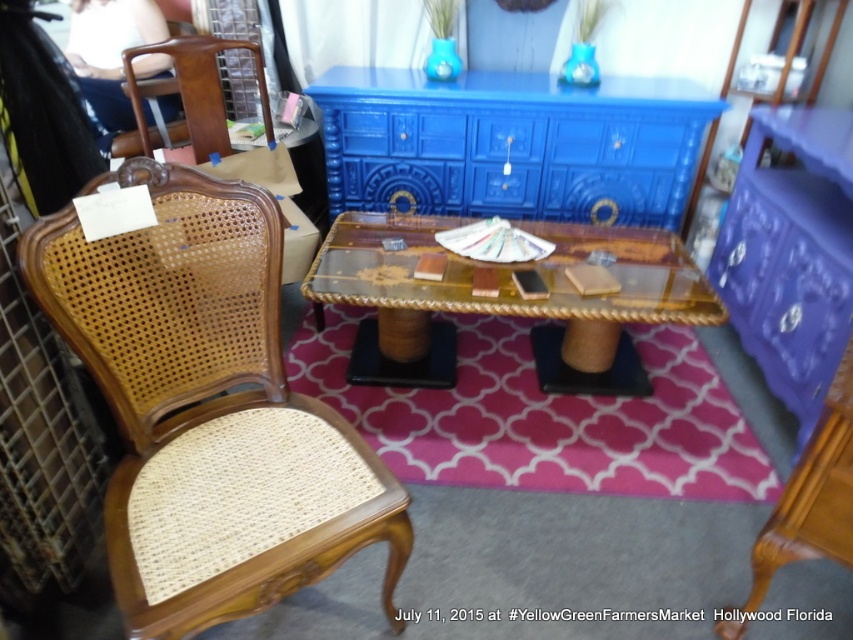
Which is more to the right, transparent acrylic table at center or purple glossy dresser at center?

From the viewer's perspective, purple glossy dresser at center appears more on the right side.

Which of these two, transparent acrylic table at center or purple glossy dresser at center, stands taller?

purple glossy dresser at center

At what (x,y) coordinates should I click in order to perform the action: click on transparent acrylic table at center. Please return your answer as a coordinate pair (x, y). Image resolution: width=853 pixels, height=640 pixels. Looking at the image, I should click on (506, 282).

Which is above, blue painted wood dresser at upper center or purple glossy dresser at center?

blue painted wood dresser at upper center

Who is lower down, blue painted wood dresser at upper center or purple glossy dresser at center?

purple glossy dresser at center

The image size is (853, 640). Describe the element at coordinates (512, 145) in the screenshot. I see `blue painted wood dresser at upper center` at that location.

Image resolution: width=853 pixels, height=640 pixels. Find the location of `blue painted wood dresser at upper center`. blue painted wood dresser at upper center is located at coordinates (x=512, y=145).

Describe the element at coordinates (512, 145) in the screenshot. This screenshot has height=640, width=853. I see `blue painted wood dresser at upper center` at that location.

Can you confirm if blue painted wood dresser at upper center is wider than transparent acrylic table at center?

Indeed, blue painted wood dresser at upper center has a greater width compared to transparent acrylic table at center.

Who is more distant from viewer, [462,84] or [442,296]?

The point [462,84] is more distant.

The image size is (853, 640). I want to click on blue painted wood dresser at upper center, so click(x=512, y=145).